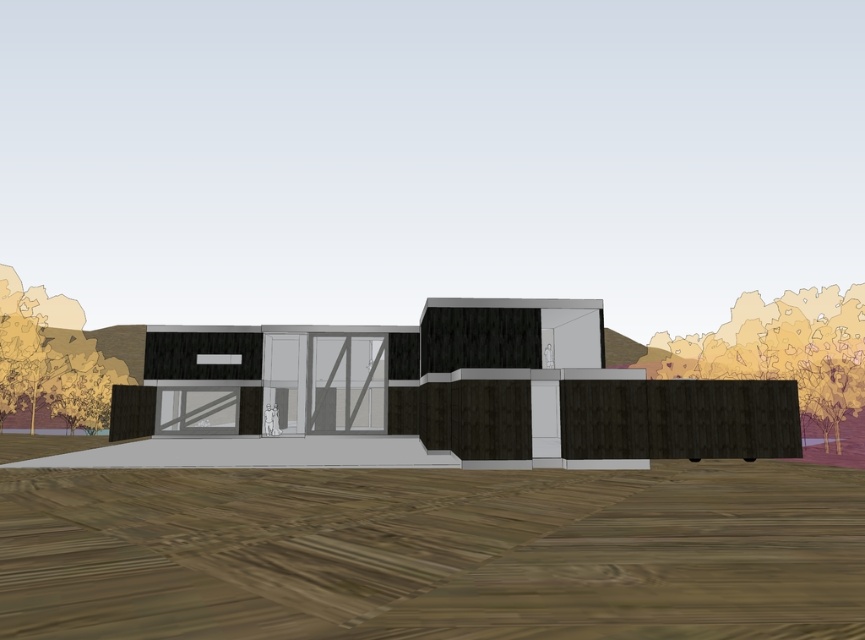
Is point (737, 307) positioned before point (55, 340)?

Yes, point (737, 307) is closer to viewer.

Who is positioned more to the right, brown wood fence at right or yellow leafy tree at left?

brown wood fence at right

Between point (818, 346) and point (69, 419), which one is positioned in front?

Positioned in front is point (818, 346).

Where is `brown wood fence at right`? This screenshot has width=865, height=640. brown wood fence at right is located at coordinates (780, 352).